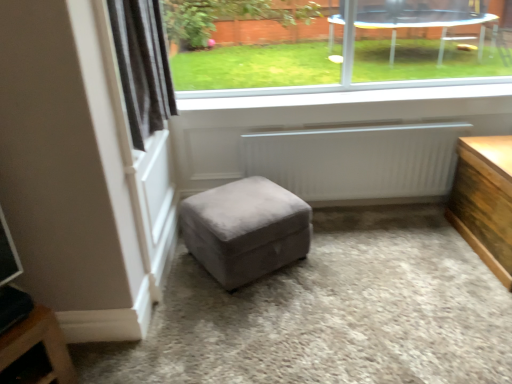
Question: Is white smooth window sill at upper center further to the viewer compared to black velvet curtain at upper left?

Choices:
 (A) no
 (B) yes

Answer: (B)

Question: Is white smooth window sill at upper center oriented towards black velvet curtain at upper left?

Choices:
 (A) no
 (B) yes

Answer: (A)

Question: Can you confirm if white smooth window sill at upper center is bigger than black velvet curtain at upper left?

Choices:
 (A) no
 (B) yes

Answer: (A)

Question: Is black velvet curtain at upper left located within white smooth window sill at upper center?

Choices:
 (A) no
 (B) yes

Answer: (A)

Question: From a real-world perspective, is white smooth window sill at upper center on top of black velvet curtain at upper left?

Choices:
 (A) yes
 (B) no

Answer: (B)

Question: From a real-world perspective, does white smooth window sill at upper center sit lower than black velvet curtain at upper left?

Choices:
 (A) no
 (B) yes

Answer: (B)

Question: Is transparent glass window at upper center far from suede gray ottoman at center?

Choices:
 (A) no
 (B) yes

Answer: (B)

Question: Is transparent glass window at upper center next to suede gray ottoman at center?

Choices:
 (A) no
 (B) yes

Answer: (A)

Question: From a real-world perspective, is transparent glass window at upper center positioned under suede gray ottoman at center based on gravity?

Choices:
 (A) no
 (B) yes

Answer: (A)

Question: Is transparent glass window at upper center to the right of suede gray ottoman at center from the viewer's perspective?

Choices:
 (A) no
 (B) yes

Answer: (B)

Question: Is suede gray ottoman at center a part of transparent glass window at upper center?

Choices:
 (A) no
 (B) yes

Answer: (A)

Question: Considering the relative positions of transparent glass window at upper center and suede gray ottoman at center in the image provided, is transparent glass window at upper center in front of suede gray ottoman at center?

Choices:
 (A) no
 (B) yes

Answer: (A)

Question: Considering the relative sizes of wooden table at right and black velvet curtain at upper left in the image provided, is wooden table at right bigger than black velvet curtain at upper left?

Choices:
 (A) no
 (B) yes

Answer: (B)